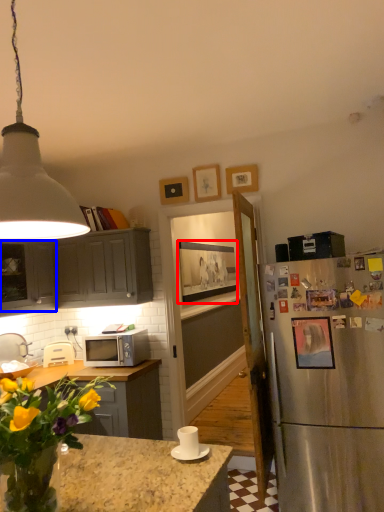
Question: Which object appears farthest to the camera in this image, picture frame (highlighted by a red box) or cabinetry (highlighted by a blue box)?

Choices:
 (A) picture frame
 (B) cabinetry

Answer: (A)